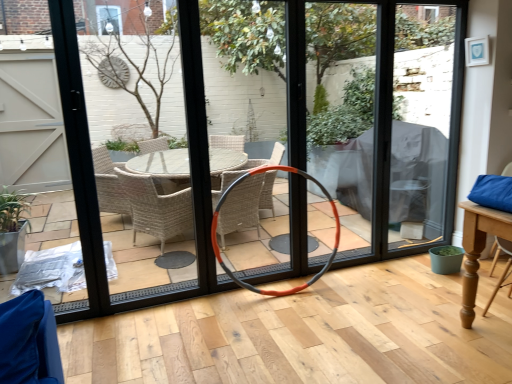
Measure the distance between orange rubber hoop at center and camera.

A distance of 3.01 meters exists between orange rubber hoop at center and camera.

The height and width of the screenshot is (384, 512). In order to click on orange rubber hoop at center in this screenshot , I will do `click(217, 224)`.

The image size is (512, 384). Describe the element at coordinates (217, 224) in the screenshot. I see `orange rubber hoop at center` at that location.

The image size is (512, 384). I want to click on orange rubber hoop at center, so click(x=217, y=224).